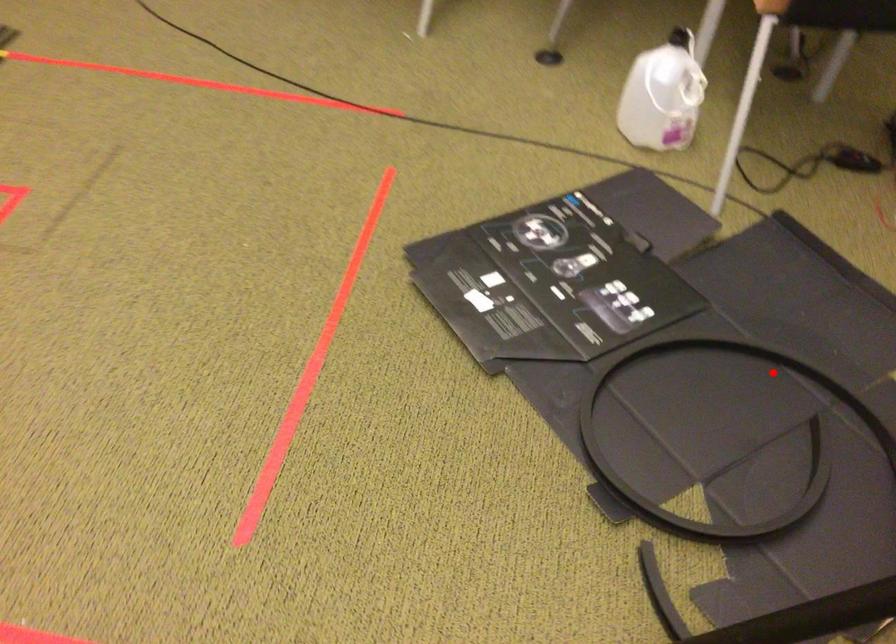
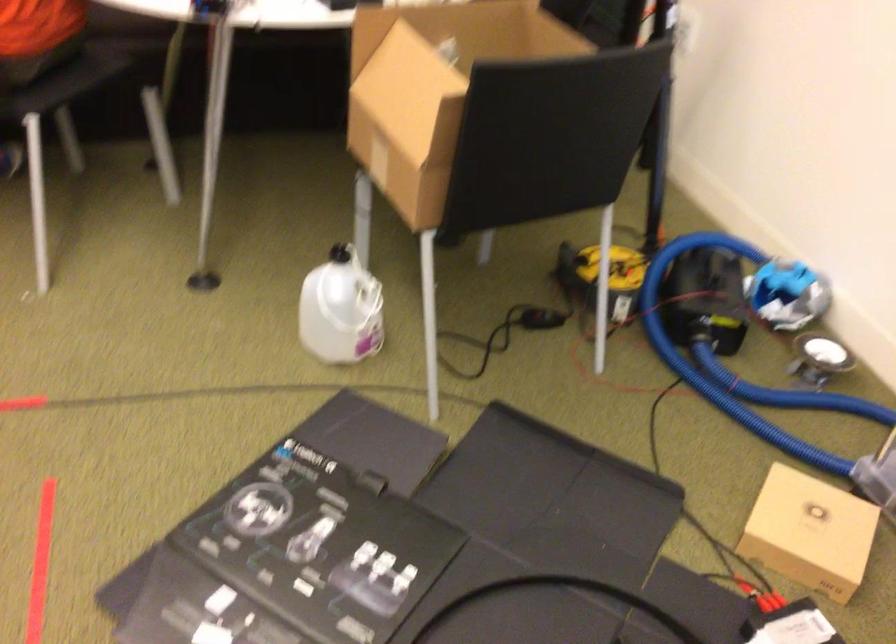
The point at the highlighted location is marked in the first image. Where is the corresponding point in the second image?

(556, 601)